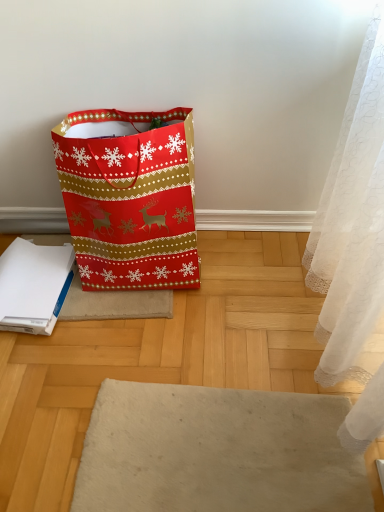
Question: Is shiny paper bag at left taller than white paper notebook at lower left?

Choices:
 (A) yes
 (B) no

Answer: (A)

Question: Does shiny paper bag at left lie behind white paper notebook at lower left?

Choices:
 (A) yes
 (B) no

Answer: (B)

Question: Is shiny paper bag at left surrounding white paper notebook at lower left?

Choices:
 (A) no
 (B) yes

Answer: (A)

Question: Could you tell me if shiny paper bag at left is turned towards white paper notebook at lower left?

Choices:
 (A) no
 (B) yes

Answer: (A)

Question: Considering the relative sizes of shiny paper bag at left and white paper notebook at lower left in the image provided, is shiny paper bag at left smaller than white paper notebook at lower left?

Choices:
 (A) no
 (B) yes

Answer: (A)

Question: Would you say shiny paper bag at left is outside white paper notebook at lower left?

Choices:
 (A) no
 (B) yes

Answer: (B)

Question: Is white paper notebook at lower left wider than shiny paper bag at left?

Choices:
 (A) no
 (B) yes

Answer: (A)

Question: Is white paper notebook at lower left oriented away from shiny paper bag at left?

Choices:
 (A) no
 (B) yes

Answer: (A)

Question: Is white paper notebook at lower left further to the viewer compared to shiny paper bag at left?

Choices:
 (A) no
 (B) yes

Answer: (B)

Question: Does white paper notebook at lower left turn towards shiny paper bag at left?

Choices:
 (A) yes
 (B) no

Answer: (B)

Question: Is white paper notebook at lower left at the left side of shiny paper bag at left?

Choices:
 (A) no
 (B) yes

Answer: (B)

Question: Is white paper notebook at lower left bigger than shiny paper bag at left?

Choices:
 (A) yes
 (B) no

Answer: (B)

Question: From a real-world perspective, is shiny paper bag at left physically located above or below white paper notebook at lower left?

Choices:
 (A) below
 (B) above

Answer: (B)